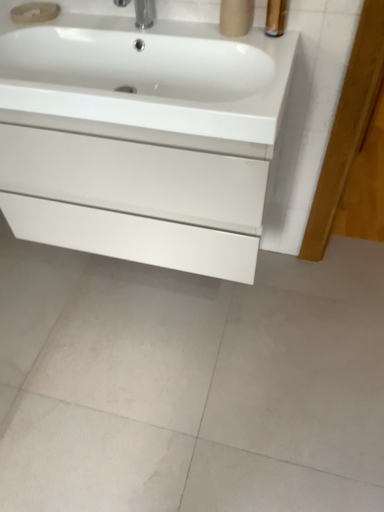
Question: From a real-world perspective, is white glossy sink at upper center positioned above or below white glossy cabinet at center?

Choices:
 (A) below
 (B) above

Answer: (B)

Question: Is white glossy sink at upper center inside or outside of white glossy cabinet at center?

Choices:
 (A) inside
 (B) outside

Answer: (A)

Question: From the image's perspective, is white glossy sink at upper center positioned above or below white glossy cabinet at center?

Choices:
 (A) below
 (B) above

Answer: (B)

Question: From the image's perspective, is white glossy cabinet at center located above or below white glossy sink at upper center?

Choices:
 (A) above
 (B) below

Answer: (B)

Question: Looking at their shapes, would you say white glossy cabinet at center is wider or thinner than white glossy sink at upper center?

Choices:
 (A) thin
 (B) wide

Answer: (A)

Question: Does point (236, 245) appear closer or farther from the camera than point (263, 74)?

Choices:
 (A) farther
 (B) closer

Answer: (A)

Question: Looking at the image, does white glossy cabinet at center seem bigger or smaller compared to white glossy sink at upper center?

Choices:
 (A) small
 (B) big

Answer: (B)